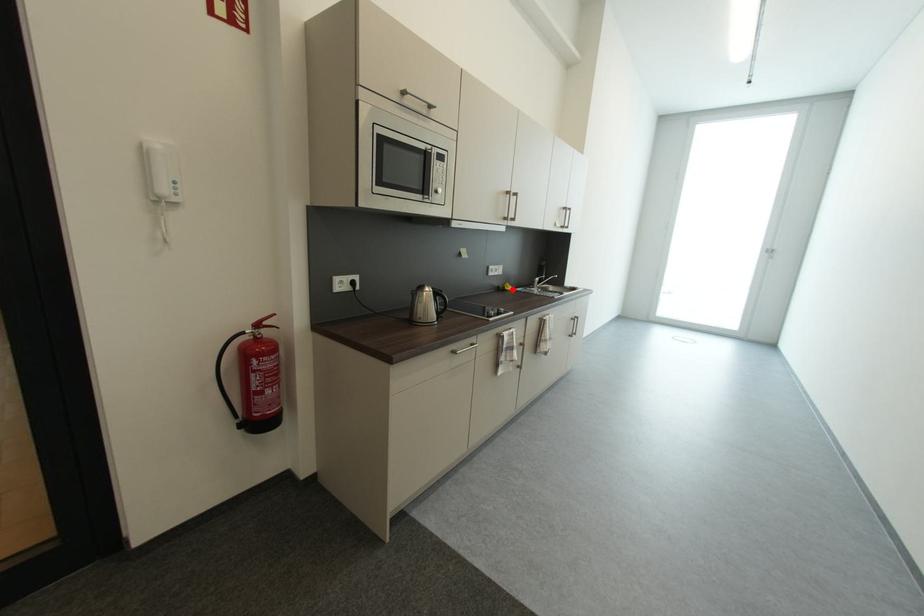
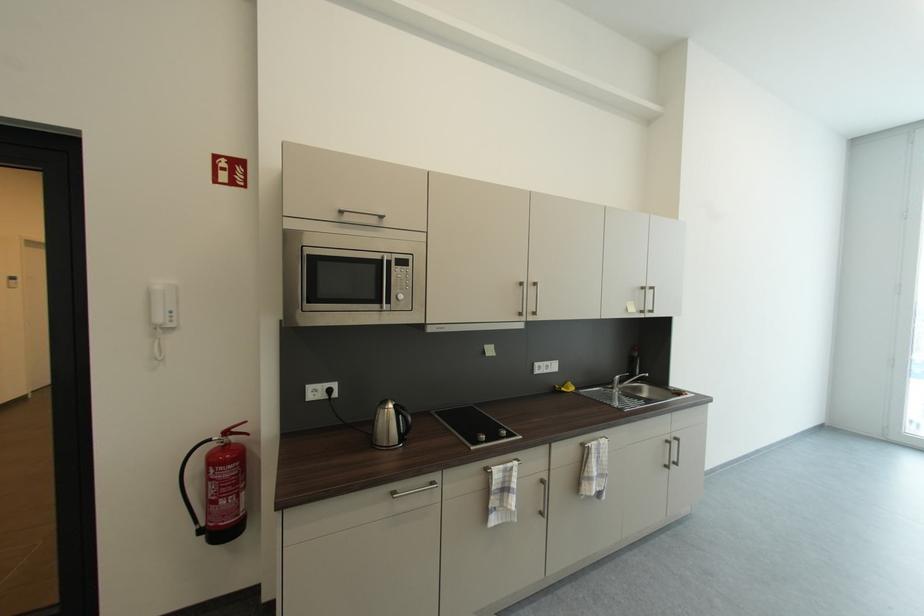
Question: I am providing you with two images of the same scene from different viewpoints. Given a red point in image1, look at the same physical point in image2. Is it:

Choices:
 (A) Closer to the viewpoint
 (B) Farther from the viewpoint

Answer: (B)